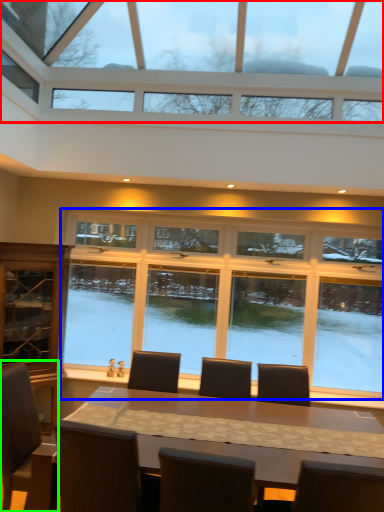
Question: Which is farther away from window (highlighted by a red box)? window (highlighted by a blue box) or chair (highlighted by a green box)?

Choices:
 (A) window
 (B) chair

Answer: (B)